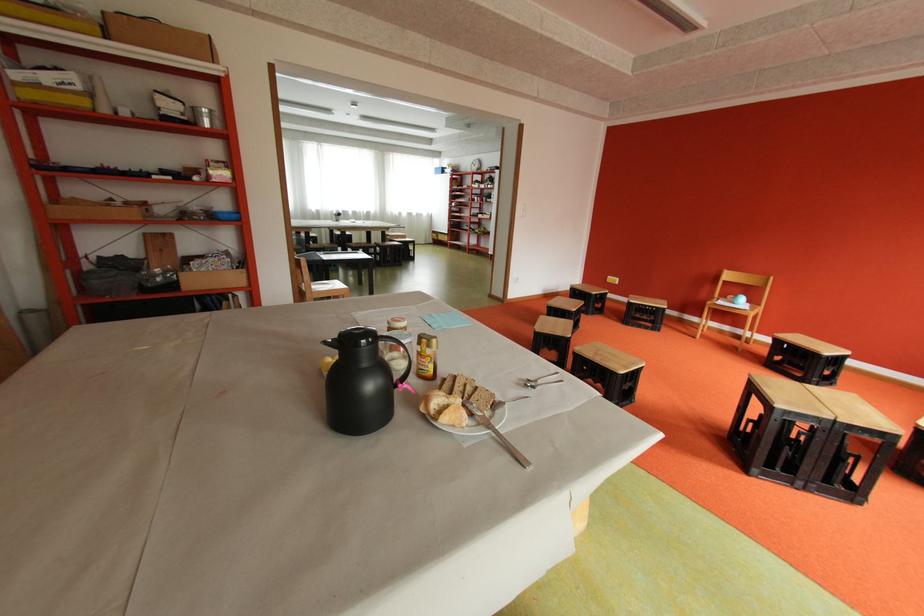
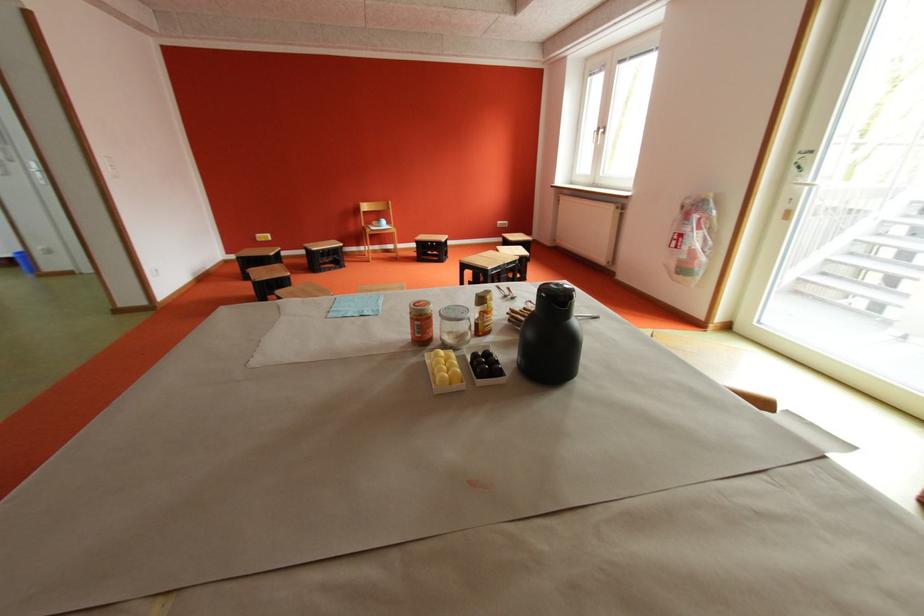
Where in the second image is the point corresponding to the point at 585,294 from the first image?

(257, 262)